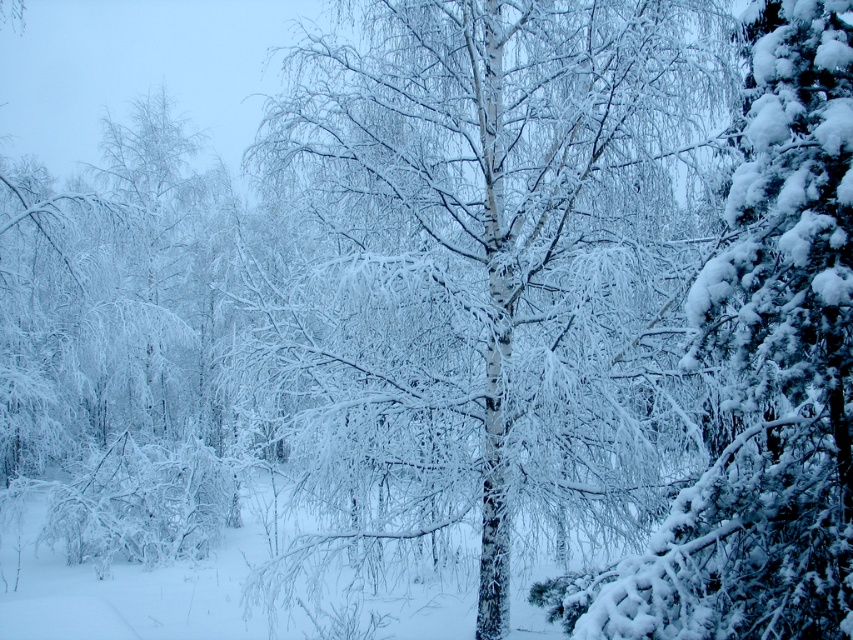
Question: Which point is closer to the camera?

Choices:
 (A) white matte tree at center
 (B) snow-covered pine at right

Answer: (B)

Question: Is white matte tree at center smaller than snow-covered pine at right?

Choices:
 (A) no
 (B) yes

Answer: (A)

Question: Considering the relative positions of white matte tree at center and snow-covered pine at right in the image provided, where is white matte tree at center located with respect to snow-covered pine at right?

Choices:
 (A) left
 (B) right

Answer: (A)

Question: Does white matte tree at center have a greater width compared to snow-covered pine at right?

Choices:
 (A) yes
 (B) no

Answer: (A)

Question: Among these points, which one is farthest from the camera?

Choices:
 (A) (830, 243)
 (B) (436, 488)

Answer: (B)